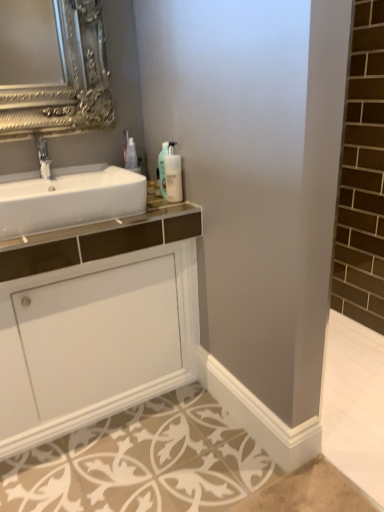
At what (x,y) coordinates should I click in order to perform the action: click on vacant space situated above white painted wood baseboard at lower center (from a real-world perspective). Please return your answer as a coordinate pair (x, y). Looking at the image, I should click on (236, 382).